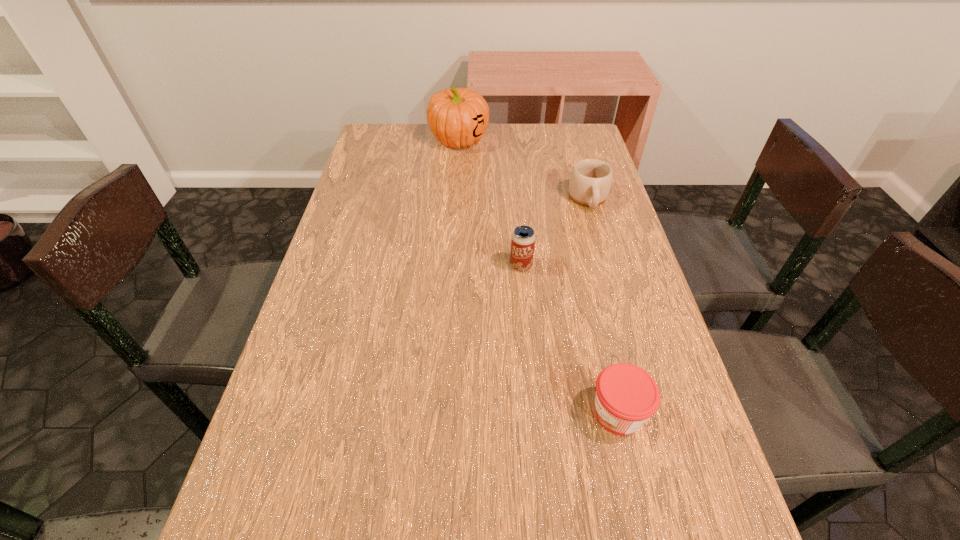
Find the location of `object that stands as the closest to the mug`. object that stands as the closest to the mug is located at coordinates (523, 238).

Locate an element on the screen. vacant space that satisfies the following two spatial constraints: 1. on the surface of the third farthest object; 2. on the left side of the pumpkin is located at coordinates (451, 265).